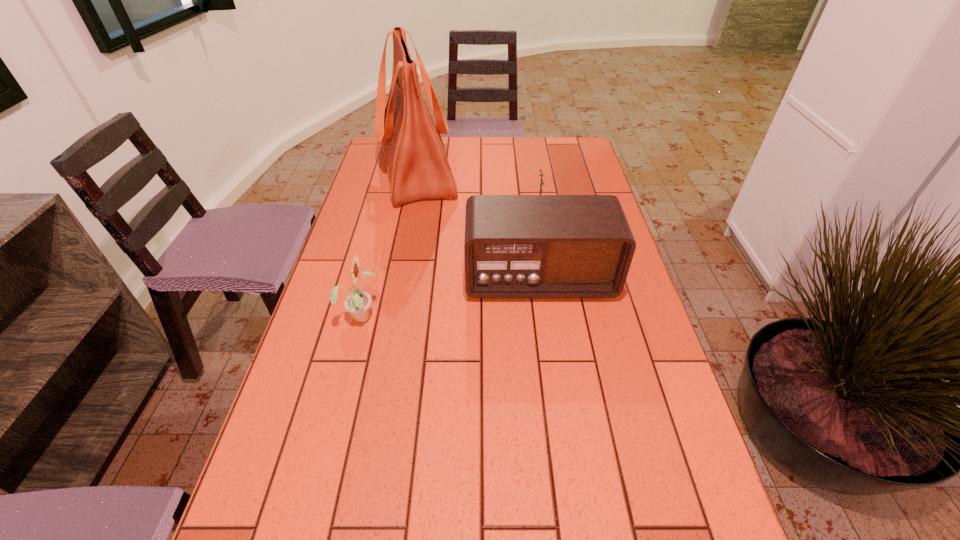
Where is `vacant space located 0.240m on the face of the farther sunflower`? vacant space located 0.240m on the face of the farther sunflower is located at coordinates (451, 217).

I want to click on free space located on the face of the farther sunflower, so click(435, 217).

This screenshot has width=960, height=540. In order to click on object situated at the far edge in this screenshot , I will do `click(418, 168)`.

You are a GUI agent. You are given a task and a screenshot of the screen. Output one action in this format:
    pyautogui.click(x=<x>, y=<y>)
    Task: Click on the shopping bag present at the left edge
    
    Given the screenshot: What is the action you would take?
    pyautogui.click(x=418, y=168)

Locate an element on the screen. This screenshot has width=960, height=540. sunflower that is positioned at the left edge is located at coordinates (358, 303).

In order to click on object present at the right edge in this screenshot , I will do `click(516, 246)`.

Where is `object present at the far left corner`? This screenshot has width=960, height=540. object present at the far left corner is located at coordinates (418, 168).

At what (x,y) coordinates should I click in order to perform the action: click on free spot at the far edge of the desktop. Please return your answer as a coordinate pair (x, y). This screenshot has height=540, width=960. Looking at the image, I should click on [x=516, y=157].

Find the location of a particular element. Image resolution: width=960 pixels, height=540 pixels. free spot at the left edge of the desktop is located at coordinates (319, 353).

In order to click on vacant space at the right edge in this screenshot , I will do `click(664, 389)`.